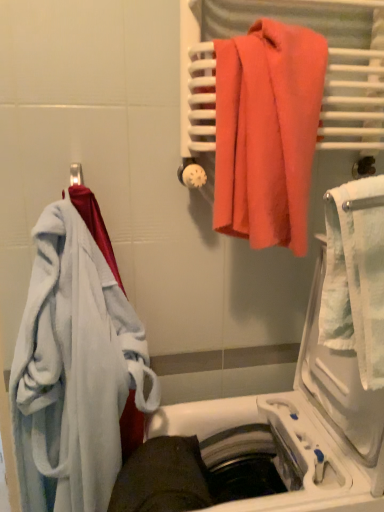
What is the approximate height of white plastic dishwasher at lower center?

Result: white plastic dishwasher at lower center is 98.35 centimeters tall.

The image size is (384, 512). Describe the element at coordinates (274, 438) in the screenshot. I see `white plastic dishwasher at lower center` at that location.

Locate an element on the screen. The height and width of the screenshot is (512, 384). soft white bathrobe at left, the second towel from the right is located at coordinates (74, 370).

The width and height of the screenshot is (384, 512). Identify the location of coral fabric towel at upper right, which is the 2th towel from bottom to top. (267, 132).

Which of these two, coral fabric towel at upper right, which is the first towel from right to left, or white textured towel at right, stands taller?

coral fabric towel at upper right, which is the first towel from right to left.

Which point is more forward, [298,42] or [317,329]?

Point [298,42]

From a real-world perspective, is coral fabric towel at upper right, which is the 2th towel from bottom to top, positioned above or below white textured towel at right?

In terms of real-world spatial position, coral fabric towel at upper right, which is the 2th towel from bottom to top, is above white textured towel at right.

Considering the relative sizes of coral fabric towel at upper right, which is the first towel from right to left, and white textured towel at right in the image provided, is coral fabric towel at upper right, which is the first towel from right to left, smaller than white textured towel at right?

No.

Could you tell me if white plastic dishwasher at lower center is turned towards white textured towel at right?

No.

Identify the location of screen door above the white plastic dishwasher at lower center (from a real-world perspective). This screenshot has width=384, height=512. (339, 381).

Is white plastic dishwasher at lower center inside or outside of white textured towel at right?

white plastic dishwasher at lower center cannot be found inside white textured towel at right.

From the picture: From the image's perspective, which one is positioned lower, white textured towel at right or white plastic dishwasher at lower center?

white plastic dishwasher at lower center.

Consider the image. Based on their sizes in the image, would you say white textured towel at right is bigger or smaller than white plastic dishwasher at lower center?

In the image, white textured towel at right appears to be smaller than white plastic dishwasher at lower center.

Is white textured towel at right looking in the opposite direction of white plastic dishwasher at lower center?

That's right, white textured towel at right is facing away from white plastic dishwasher at lower center.

How much distance is there between white textured towel at right and white plastic dishwasher at lower center?

A distance of 4.46 inches exists between white textured towel at right and white plastic dishwasher at lower center.

Who is bigger, white plastic dishwasher at lower center or soft white bathrobe at left, the 1th towel when ordered from bottom to top?

Bigger between the two is white plastic dishwasher at lower center.

From the image's perspective, between white plastic dishwasher at lower center and soft white bathrobe at left, which is counted as the first towel, starting from the left, which one is located above?

From the image's view, soft white bathrobe at left, which is counted as the first towel, starting from the left, is above.

Is white plastic dishwasher at lower center oriented away from soft white bathrobe at left, which is counted as the first towel, starting from the left?

No, white plastic dishwasher at lower center is not facing away from soft white bathrobe at left, which is counted as the first towel, starting from the left.

Considering the points (47, 213) and (197, 420), which point is behind, point (47, 213) or point (197, 420)?

The point (197, 420) is farther.

Who is shorter, soft white bathrobe at left, which is counted as the second towel, starting from the top, or white plastic dishwasher at lower center?

soft white bathrobe at left, which is counted as the second towel, starting from the top, is shorter.

Which of these two, soft white bathrobe at left, the 1th towel when ordered from bottom to top, or white plastic dishwasher at lower center, is thinner?

Thinner between the two is soft white bathrobe at left, the 1th towel when ordered from bottom to top.

Is there a large distance between soft white bathrobe at left, the 1th towel when ordered from bottom to top, and white textured towel at right?

soft white bathrobe at left, the 1th towel when ordered from bottom to top, is near white textured towel at right, not far away.

Can you confirm if soft white bathrobe at left, which is counted as the first towel, starting from the left, is bigger than white textured towel at right?

Yes, soft white bathrobe at left, which is counted as the first towel, starting from the left, is bigger than white textured towel at right.

Do you think soft white bathrobe at left, which is counted as the second towel, starting from the top, is within white textured towel at right, or outside of it?

soft white bathrobe at left, which is counted as the second towel, starting from the top, is not inside white textured towel at right, it's outside.

Which object is positioned more to the right, soft white bathrobe at left, the 1th towel when ordered from bottom to top, or white textured towel at right?

From the viewer's perspective, white textured towel at right appears more on the right side.

Is white textured towel at right in front of or behind coral fabric towel at upper right, which is counted as the first towel, starting from the top, in the image?

white textured towel at right is positioned closer to the viewer than coral fabric towel at upper right, which is counted as the first towel, starting from the top.

Would you say white textured towel at right is inside or outside coral fabric towel at upper right, which is the first towel from right to left?

white textured towel at right lies outside coral fabric towel at upper right, which is the first towel from right to left.

At what (x,y) coordinates should I click in order to perform the action: click on screen door that appears below the coral fabric towel at upper right, which is counted as the first towel, starting from the top (from the image's perspective). Please return your answer as a coordinate pair (x, y). This screenshot has width=384, height=512. Looking at the image, I should click on (339, 381).

Identify the location of towel lying above the white textured towel at right (from the image's perspective). (267, 132).

What are the coordinates of `dish washer that appears below the white textured towel at right (from the image's perspective)` in the screenshot? It's located at (274, 438).

Looking at the image, which one is located closer to white plastic dishwasher at lower center, soft white bathrobe at left, which is counted as the first towel, starting from the left, or coral fabric towel at upper right, the second towel positioned from the left?

soft white bathrobe at left, which is counted as the first towel, starting from the left, lies closer to white plastic dishwasher at lower center than the other object.

Looking at this image, which object lies further to the anchor point soft white bathrobe at left, the second towel from the right, white plastic dishwasher at lower center or coral fabric towel at upper right, which is counted as the first towel, starting from the top?

Based on the image, coral fabric towel at upper right, which is counted as the first towel, starting from the top, appears to be further to soft white bathrobe at left, the second towel from the right.

When comparing their distances from white textured towel at right, does soft white bathrobe at left, the 1th towel when ordered from bottom to top, or coral fabric towel at upper right, which is counted as the first towel, starting from the top, seem closer?

coral fabric towel at upper right, which is counted as the first towel, starting from the top, is closer to white textured towel at right.

Estimate the real-world distances between objects in this image. Which object is further from soft white bathrobe at left, the second towel from the right, coral fabric towel at upper right, the second towel positioned from the left, or white plastic dishwasher at lower center?

coral fabric towel at upper right, the second towel positioned from the left, is positioned further to the anchor soft white bathrobe at left, the second towel from the right.

Considering their positions, is white textured towel at right positioned closer to coral fabric towel at upper right, the second towel positioned from the left, than soft white bathrobe at left, which is counted as the first towel, starting from the left?

white textured towel at right is positioned closer to the anchor coral fabric towel at upper right, the second towel positioned from the left.

Which object lies nearer to the anchor point white plastic dishwasher at lower center, coral fabric towel at upper right, the second towel positioned from the left, or soft white bathrobe at left, the 1th towel when ordered from bottom to top?

Among the two, soft white bathrobe at left, the 1th towel when ordered from bottom to top, is located nearer to white plastic dishwasher at lower center.

When comparing their distances from white textured towel at right, does coral fabric towel at upper right, which is the first towel from right to left, or soft white bathrobe at left, which is counted as the second towel, starting from the top, seem further?

soft white bathrobe at left, which is counted as the second towel, starting from the top, lies further to white textured towel at right than the other object.

When comparing their distances from white plastic dishwasher at lower center, does white textured towel at right or coral fabric towel at upper right, which is counted as the first towel, starting from the top, seem closer?

white textured towel at right.

You are a GUI agent. You are given a task and a screenshot of the screen. Output one action in this format:
    pyautogui.click(x=<x>, y=<y>)
    Task: Click on the dish washer between soft white bathrobe at left, the 1th towel when ordered from bottom to top, and white textured towel at right, in the horizontal direction
    
    Given the screenshot: What is the action you would take?
    pyautogui.click(x=274, y=438)

I want to click on towel between soft white bathrobe at left, which is counted as the first towel, starting from the left, and white textured towel at right, in the horizontal direction, so click(x=267, y=132).

Where is `screen door between coral fabric towel at upper right, the second towel positioned from the left, and white plastic dishwasher at lower center vertically`? This screenshot has height=512, width=384. screen door between coral fabric towel at upper right, the second towel positioned from the left, and white plastic dishwasher at lower center vertically is located at coordinates (339, 381).

I want to click on towel between coral fabric towel at upper right, the second towel positioned from the left, and white plastic dishwasher at lower center from top to bottom, so click(x=74, y=370).